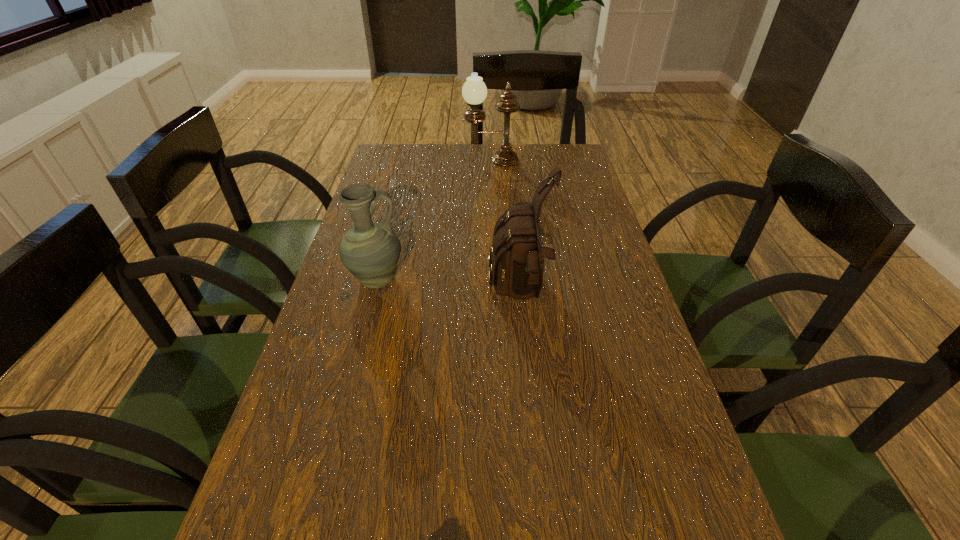
Identify the location of free space at the far edge of the desktop. (510, 167).

Where is `free spot at the left edge of the desktop`? The image size is (960, 540). free spot at the left edge of the desktop is located at coordinates point(287,455).

In the image, there is a desktop. In order to click on vacant space at the right edge in this screenshot , I will do `click(678, 491)`.

Where is `vacant space at the far right corner of the desktop`? The height and width of the screenshot is (540, 960). vacant space at the far right corner of the desktop is located at coordinates (567, 148).

I want to click on empty space between the shoulder bag and the leftmost object, so click(x=448, y=288).

Find the location of `free space between the oil lamp and the leftmost object`. free space between the oil lamp and the leftmost object is located at coordinates (434, 220).

I want to click on free space between the pitcher and the shoulder bag, so click(448, 288).

This screenshot has height=540, width=960. What are the coordinates of `vacant area between the pitcher and the shoulder bag` in the screenshot? It's located at (448, 288).

This screenshot has width=960, height=540. Find the location of `object that can be found as the closest to the leftmost object`. object that can be found as the closest to the leftmost object is located at coordinates [517, 264].

Image resolution: width=960 pixels, height=540 pixels. Identify the location of object that is the second closest one to the farthest object. (370, 251).